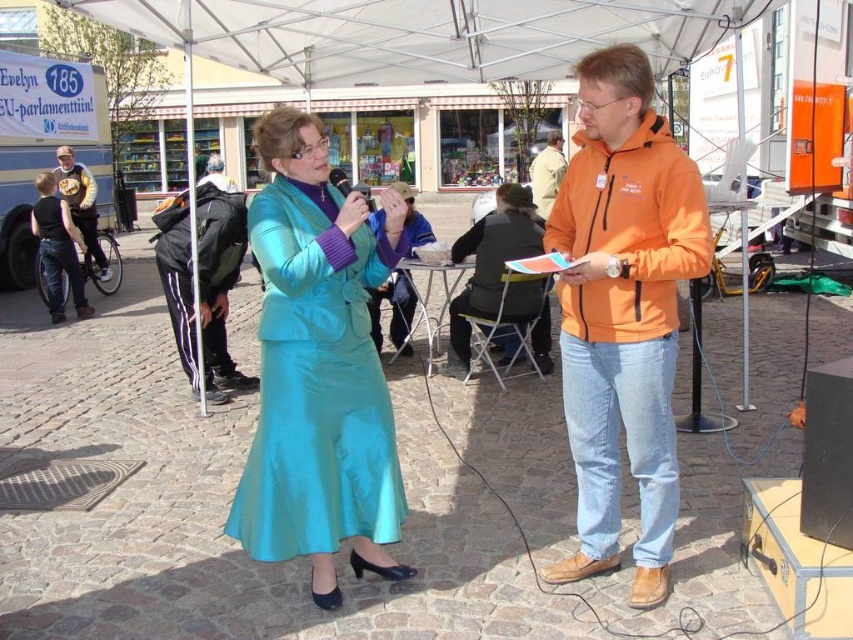
Question: Among these points, which one is farthest from the camera?

Choices:
 (A) (543, 161)
 (B) (520, 184)
 (C) (674, 256)
 (D) (392, 321)

Answer: (B)

Question: Based on their relative distances, which object is nearer to the orange fabric jacket at center?

Choices:
 (A) turquoise satin dress at center
 (B) blue denim jacket at center
 (C) orange fleece jacket at right
 (D) orange fleece jacket at center

Answer: (B)

Question: Is orange fleece jacket at right smaller than black track pants at center?

Choices:
 (A) yes
 (B) no

Answer: (A)

Question: Does orange fleece jacket at center appear on the left side of orange fleece jacket at right?

Choices:
 (A) no
 (B) yes

Answer: (B)

Question: Does turquoise satin dress at center come in front of orange fleece jacket at right?

Choices:
 (A) yes
 (B) no

Answer: (B)

Question: Which object appears closest to the camera in this image?

Choices:
 (A) orange fleece jacket at center
 (B) orange fleece jacket at upper right
 (C) black track pants at center
 (D) orange fabric jacket at center

Answer: (A)